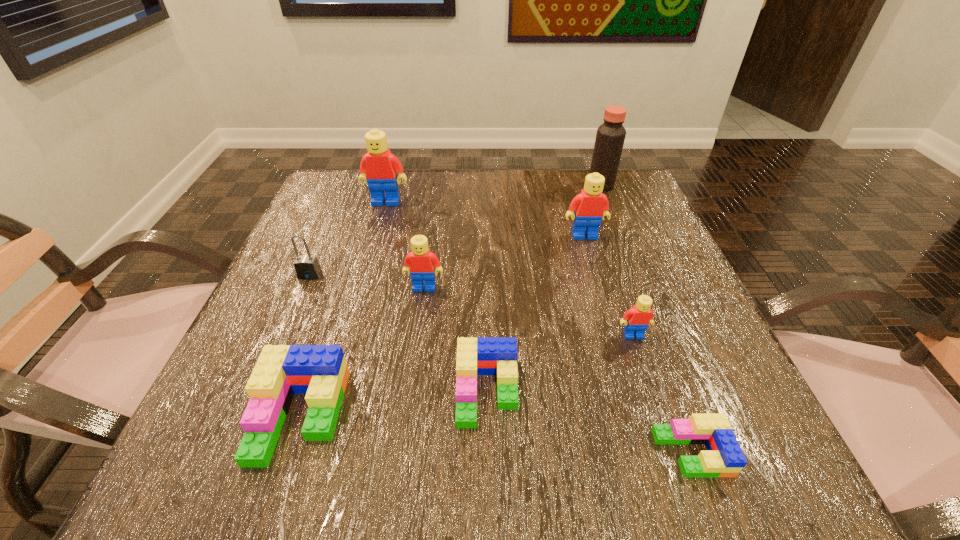
Find the location of a particular element. The width and height of the screenshot is (960, 540). vinegar that is at the right edge is located at coordinates (610, 137).

The height and width of the screenshot is (540, 960). I want to click on object present at the far left corner, so click(379, 168).

The width and height of the screenshot is (960, 540). In order to click on object positioned at the near left corner in this screenshot , I will do `click(320, 371)`.

Where is `object located in the far right corner section of the desktop`? object located in the far right corner section of the desktop is located at coordinates (610, 137).

Where is `object that is at the near right corner`? The width and height of the screenshot is (960, 540). object that is at the near right corner is located at coordinates (724, 457).

In the image, there is a desktop. Find the location of `vacant space at the far edge`. vacant space at the far edge is located at coordinates (490, 174).

In the image, there is a desktop. Where is `vacant region at the near edge`? The height and width of the screenshot is (540, 960). vacant region at the near edge is located at coordinates (568, 472).

What are the coordinates of `vacant region at the left edge` in the screenshot? It's located at (347, 314).

The width and height of the screenshot is (960, 540). In order to click on vacant space at the right edge of the desktop in this screenshot , I will do `click(660, 261)`.

The image size is (960, 540). Find the location of `free space at the far left corner of the desktop`. free space at the far left corner of the desktop is located at coordinates (311, 208).